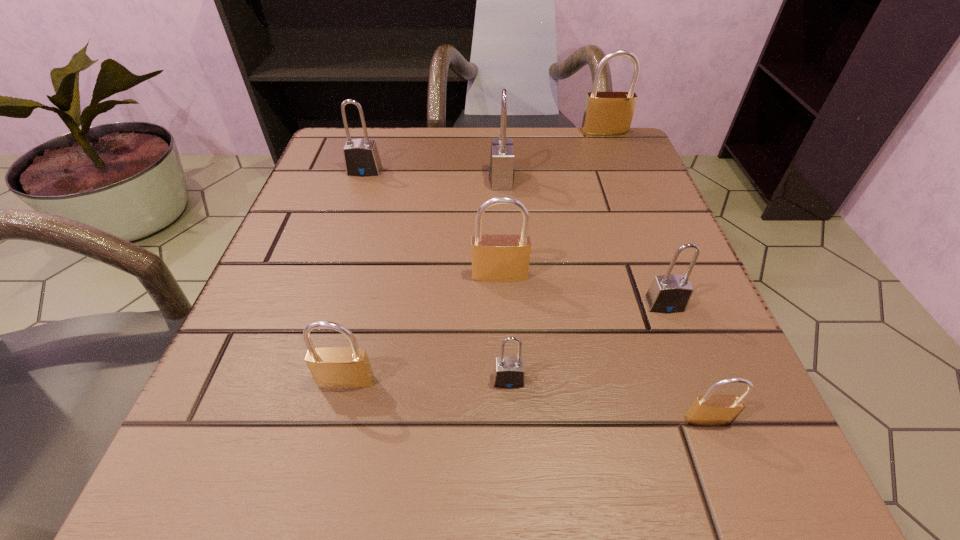
At what (x,y) coordinates should I click in order to perform the action: click on the smallest gray padlock. Please return your answer as a coordinate pair (x, y). This screenshot has height=540, width=960. Looking at the image, I should click on (508, 372).

This screenshot has height=540, width=960. Identify the location of the nearest brass padlock. (707, 410).

Where is `the nearest padlock`? the nearest padlock is located at coordinates (707, 410).

The width and height of the screenshot is (960, 540). I want to click on free location located 0.200m on the front-facing side of the farthest brass padlock, so click(x=626, y=187).

What are the coordinates of `free space located on the shackle of the biggest gray padlock` in the screenshot? It's located at (398, 179).

Where is `free space located 0.210m on the shackle of the biggest gray padlock`? free space located 0.210m on the shackle of the biggest gray padlock is located at coordinates (383, 179).

What are the coordinates of `vacant space situated 0.350m on the shackle of the biggest gray padlock` in the screenshot? It's located at (313, 179).

In order to click on vacant region located 0.260m on the shackle of the leftmost gray padlock in this screenshot , I will do `click(333, 268)`.

Where is `vacant space situated on the front-facing side of the second biggest brass padlock`? vacant space situated on the front-facing side of the second biggest brass padlock is located at coordinates (501, 317).

In order to click on free location located on the shackle of the rightmost gray padlock in this screenshot , I will do `click(699, 394)`.